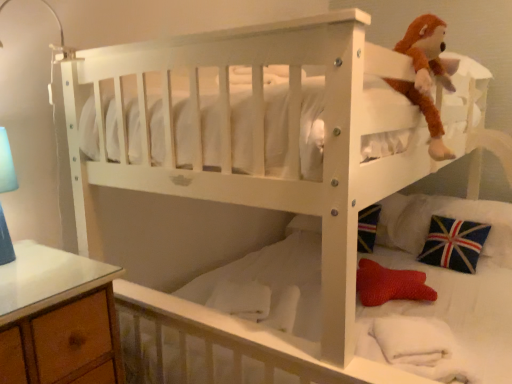
Question: In terms of height, does brown plush toy at upper right look taller or shorter compared to union jack fabric pillow at lower right?

Choices:
 (A) short
 (B) tall

Answer: (B)

Question: Is brown plush toy at upper right inside or outside of union jack fabric pillow at lower right?

Choices:
 (A) inside
 (B) outside

Answer: (B)

Question: From the image's perspective, relative to union jack fabric pillow at lower right, is brown plush toy at upper right above or below?

Choices:
 (A) above
 (B) below

Answer: (A)

Question: Does point (471, 210) appear closer or farther from the camera than point (419, 51)?

Choices:
 (A) farther
 (B) closer

Answer: (A)

Question: From a real-world perspective, is union jack fabric pillow at lower right positioned above or below brown plush toy at upper right?

Choices:
 (A) above
 (B) below

Answer: (B)

Question: In terms of width, does union jack fabric pillow at lower right look wider or thinner when compared to brown plush toy at upper right?

Choices:
 (A) thin
 (B) wide

Answer: (B)

Question: Based on their sizes in the image, would you say union jack fabric pillow at lower right is bigger or smaller than brown plush toy at upper right?

Choices:
 (A) small
 (B) big

Answer: (B)